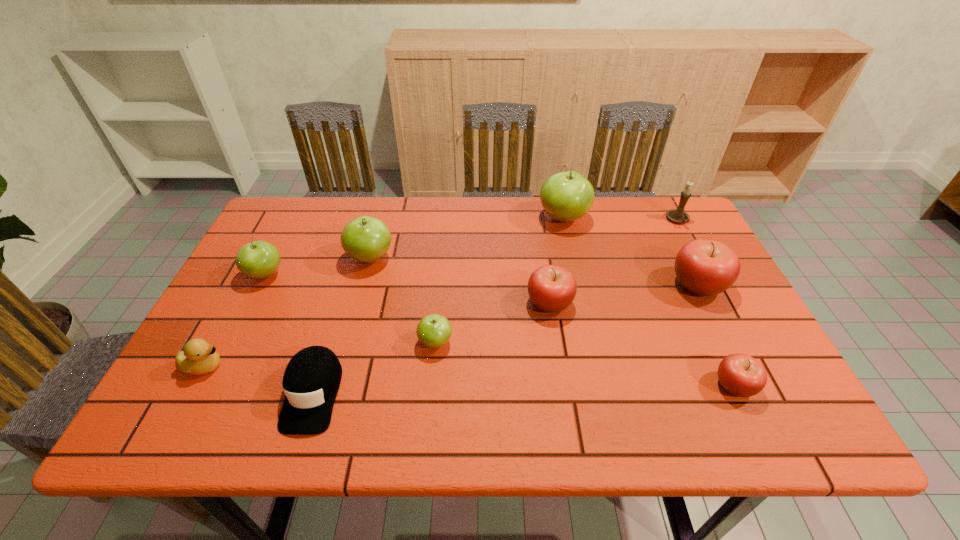
Locate an element on the screen. the fifth object from left to right is located at coordinates (434, 330).

You are a GUI agent. You are given a task and a screenshot of the screen. Output one action in this format:
    pyautogui.click(x=<x>, y=<y>)
    Task: Click on the duckling
    This screenshot has width=960, height=540.
    Given the screenshot: What is the action you would take?
    pyautogui.click(x=198, y=357)

The width and height of the screenshot is (960, 540). I want to click on the nearest apple, so click(739, 374).

Locate an element on the screen. Image resolution: width=960 pixels, height=540 pixels. the smallest red apple is located at coordinates (739, 374).

Image resolution: width=960 pixels, height=540 pixels. I want to click on cap, so click(311, 380).

Where is `vacant region located 0.340m on the left of the biggest green apple`? Image resolution: width=960 pixels, height=540 pixels. vacant region located 0.340m on the left of the biggest green apple is located at coordinates (429, 218).

You are a GUI agent. You are given a task and a screenshot of the screen. Output one action in this format:
    pyautogui.click(x=<x>, y=<y>)
    Task: Click on the vacant space located 0.300m on the front of the second biggest green apple
    Image resolution: width=960 pixels, height=540 pixels.
    Given the screenshot: What is the action you would take?
    pyautogui.click(x=342, y=366)

Locate an element on the screen. blank area located on the left of the biggest red apple is located at coordinates (541, 285).

Identify the location of free region located 0.220m on the side of the candle holder with the handle. (709, 279).

This screenshot has width=960, height=540. Find the location of `vacant space situated on the front of the third biggest green apple`. vacant space situated on the front of the third biggest green apple is located at coordinates (225, 354).